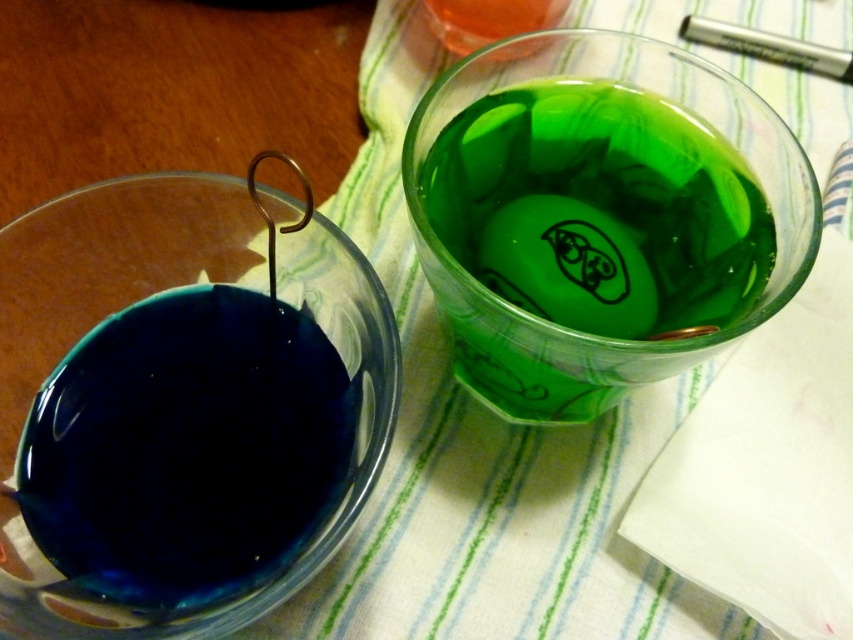
Which is above, green translucent glass at upper right or translucent orange liquid at upper center?

translucent orange liquid at upper center is above.

Between green translucent glass at upper right and translucent orange liquid at upper center, which one appears on the left side from the viewer's perspective?

translucent orange liquid at upper center is more to the left.

This screenshot has height=640, width=853. Find the location of `green translucent glass at upper right`. green translucent glass at upper right is located at coordinates (589, 241).

Is green translucent glass at upper right taller than transparent blue liquid at left?

No.

What do you see at coordinates (589, 241) in the screenshot? This screenshot has width=853, height=640. I see `green translucent glass at upper right` at bounding box center [589, 241].

Find the location of a particular element. green translucent glass at upper right is located at coordinates (589, 241).

Is point (229, 605) positioned before point (497, 52)?

Yes, it is in front of point (497, 52).

Describe the element at coordinates (114, 257) in the screenshot. The height and width of the screenshot is (640, 853). I see `transparent blue liquid at left` at that location.

The height and width of the screenshot is (640, 853). What are the coordinates of `transparent blue liquid at left` in the screenshot? It's located at pyautogui.click(x=114, y=257).